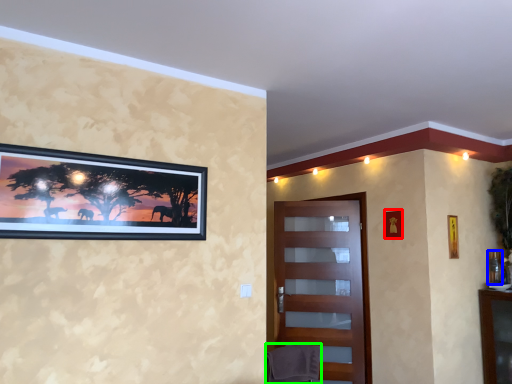
Question: Which object is positioned closest to picture frame (highlighted by a red box)? Select from picture frame (highlighted by a blue box) and swivel chair (highlighted by a green box).

Choices:
 (A) picture frame
 (B) swivel chair

Answer: (A)